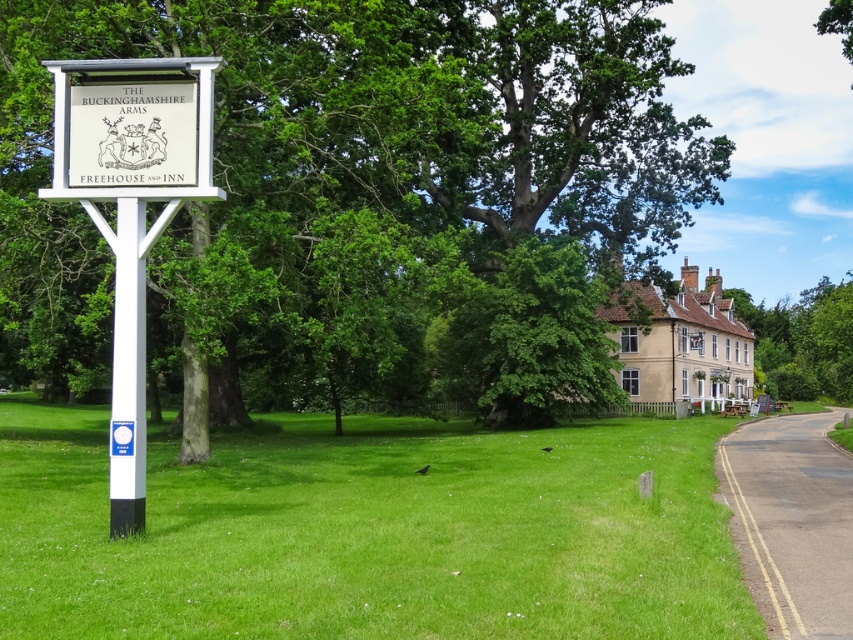
Question: Can you confirm if green leafy tree at upper center is smaller than green leafy tree at right?

Choices:
 (A) yes
 (B) no

Answer: (B)

Question: Can you confirm if green leafy tree at upper center is positioned above white plastic pole at left?

Choices:
 (A) no
 (B) yes

Answer: (B)

Question: Based on their relative distances, which object is nearer to the green grass at center?

Choices:
 (A) white plastic pole at left
 (B) white wooden sign at left

Answer: (B)

Question: Which point is farther to the camera?

Choices:
 (A) (489, 401)
 (B) (489, 545)
 (C) (131, 417)

Answer: (A)

Question: Is green grass at center wider than white wooden sign at left?

Choices:
 (A) no
 (B) yes

Answer: (B)

Question: Among these objects, which one is nearest to the camera?

Choices:
 (A) white wooden sign at left
 (B) green leafy tree at right
 (C) green grass at center
 (D) white plastic pole at left

Answer: (C)